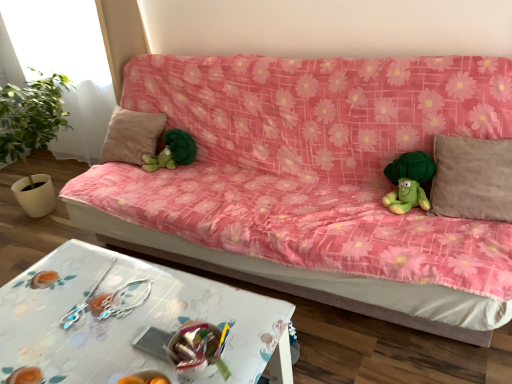
What do you see at coordinates (83, 304) in the screenshot? I see `silver metallic earrings at lower center` at bounding box center [83, 304].

Where is `beige fabric pillow at center, acting as the 2th pillow starting from the right`? beige fabric pillow at center, acting as the 2th pillow starting from the right is located at coordinates (132, 136).

The height and width of the screenshot is (384, 512). What do you see at coordinates (132, 320) in the screenshot?
I see `white glossy table at lower center` at bounding box center [132, 320].

What do you see at coordinates (409, 182) in the screenshot? This screenshot has height=384, width=512. I see `green plush toy at right, the second toy from the left` at bounding box center [409, 182].

You are a GUI agent. You are given a task and a screenshot of the screen. Output one action in this format:
    pyautogui.click(x=<x>, y=<y>)
    Task: Click on the green plush toy at center, which is counted as the second toy, starting from the front
    
    Given the screenshot: What is the action you would take?
    pyautogui.click(x=172, y=152)

The image size is (512, 384). What do you see at coordinates (172, 152) in the screenshot? I see `green plush toy at center, acting as the 1th toy starting from the left` at bounding box center [172, 152].

What do you see at coordinates (472, 178) in the screenshot? I see `beige fabric pillow at right, which is counted as the 2th pillow, starting from the left` at bounding box center [472, 178].

Identify the location of transparent glass window at upper left. (63, 65).

What is the approximate height of transparent glass window at upper left?

1.15 meters.

I want to click on silver metallic earrings at lower center, so (x=83, y=304).

Between white glossy table at lower center and silver metallic earrings at lower center, which one is positioned behind?

silver metallic earrings at lower center is further from the camera.

Between white glossy table at lower center and silver metallic earrings at lower center, which one has more height?

white glossy table at lower center.

Is white glossy table at lower center not close to silver metallic earrings at lower center?

Actually, white glossy table at lower center and silver metallic earrings at lower center are a little close together.

Considering the sizes of objects white glossy table at lower center and silver metallic earrings at lower center in the image provided, who is wider, white glossy table at lower center or silver metallic earrings at lower center?

white glossy table at lower center.

Which is correct: beige fabric pillow at right, which is counted as the 2th pillow, starting from the left, is inside transparent glass window at upper left, or outside of it?

beige fabric pillow at right, which is counted as the 2th pillow, starting from the left, is located beyond the bounds of transparent glass window at upper left.

Which object is thinner, beige fabric pillow at right, which appears as the first pillow when viewed from the right, or transparent glass window at upper left?

With smaller width is transparent glass window at upper left.

Which object is closer to the camera, beige fabric pillow at right, the 2th pillow in the back-to-front sequence, or transparent glass window at upper left?

beige fabric pillow at right, the 2th pillow in the back-to-front sequence, is more forward.

Are beige fabric pillow at right, which ranks as the first pillow in front-to-back order, and transparent glass window at upper left making contact?

No, beige fabric pillow at right, which ranks as the first pillow in front-to-back order, is not in contact with transparent glass window at upper left.

Does white glossy table at lower center have a smaller size compared to green plush toy at right, positioned as the 1th toy in right-to-left order?

No.

From a real-world perspective, is white glossy table at lower center on green plush toy at right, the second toy from the left?

Incorrect, from a real-world perspective, white glossy table at lower center is lower than green plush toy at right, the second toy from the left.

Who is taller, white glossy table at lower center or green plush toy at right, the second toy from the left?

white glossy table at lower center is taller.

Consider the image. Measure the distance between white glossy table at lower center and green plush toy at right, positioned as the 1th toy in right-to-left order.

37.05 inches.

Considering the points (409, 205) and (313, 78), which point is behind, point (409, 205) or point (313, 78)?

The point (313, 78) is more distant.

From their relative heights in the image, would you say green plush toy at right, the second toy from the left, is taller or shorter than pink floral fabric couch at center?

green plush toy at right, the second toy from the left, is shorter than pink floral fabric couch at center.

Consider the image. From a real-world perspective, between green plush toy at right, positioned as the 1th toy in right-to-left order, and pink floral fabric couch at center, who is vertically higher?

green plush toy at right, positioned as the 1th toy in right-to-left order, is physically above.

Considering the positions of objects green plush toy at right, the second toy when ordered from back to front, and pink floral fabric couch at center in the image provided, who is more to the right, green plush toy at right, the second toy when ordered from back to front, or pink floral fabric couch at center?

green plush toy at right, the second toy when ordered from back to front, is more to the right.

Is beige fabric pillow at center, placed as the first pillow when sorted from left to right, far away from green plush toy at right, the second toy from the left?

Yes, beige fabric pillow at center, placed as the first pillow when sorted from left to right, and green plush toy at right, the second toy from the left, are quite far apart.

Considering the points (132, 133) and (399, 168), which point is behind, point (132, 133) or point (399, 168)?

The point (132, 133) is more distant.

Is beige fabric pillow at center, placed as the first pillow when sorted from left to right, to the left or to the right of green plush toy at right, the second toy when ordered from back to front, in the image?

beige fabric pillow at center, placed as the first pillow when sorted from left to right, is positioned on green plush toy at right, the second toy when ordered from back to front,'s left side.

Based on the photo, could you tell me if silver metallic earrings at lower center is facing transparent glass window at upper left?

No, silver metallic earrings at lower center is not turned towards transparent glass window at upper left.

Who is taller, silver metallic earrings at lower center or transparent glass window at upper left?

Standing taller between the two is transparent glass window at upper left.

Is point (113, 264) farther from camera compared to point (84, 53)?

No, (113, 264) is closer to viewer.

Which of these two, silver metallic earrings at lower center or transparent glass window at upper left, is bigger?

Bigger between the two is transparent glass window at upper left.

Does beige fabric pillow at center, placed as the first pillow when sorted from left to right, contain transparent glass window at upper left?

That's incorrect, transparent glass window at upper left is not inside beige fabric pillow at center, placed as the first pillow when sorted from left to right.

Is beige fabric pillow at center, acting as the 2th pillow starting from the right, oriented towards transparent glass window at upper left?

No, beige fabric pillow at center, acting as the 2th pillow starting from the right, does not turn towards transparent glass window at upper left.

From a real-world perspective, is beige fabric pillow at center, the 2th pillow when ordered from front to back, above or below transparent glass window at upper left?

beige fabric pillow at center, the 2th pillow when ordered from front to back, is below transparent glass window at upper left.

Between beige fabric pillow at center, arranged as the first pillow when viewed from the back, and transparent glass window at upper left, which one has more height?

transparent glass window at upper left is taller.

What are the coordinates of `twin behind the white glossy table at lower center` in the screenshot? It's located at (83, 304).

From the image's perspective, which pillow is the 2nd one below the transparent glass window at upper left? Please provide its 2D coordinates.

[(472, 178)]

Which object lies further to the anchor point transparent glass window at upper left, green plush toy at center, marked as the 2th toy in a right-to-left arrangement, or beige fabric pillow at right, the 2th pillow in the back-to-front sequence?

Based on the image, beige fabric pillow at right, the 2th pillow in the back-to-front sequence, appears to be further to transparent glass window at upper left.

Consider the image. Considering their positions, is beige fabric pillow at center, the 2th pillow when ordered from front to back, positioned further to pink floral fabric couch at center than beige fabric pillow at right, the 2th pillow in the back-to-front sequence?

Based on the image, beige fabric pillow at center, the 2th pillow when ordered from front to back, appears to be further to pink floral fabric couch at center.

Estimate the real-world distances between objects in this image. Which object is further from transparent glass window at upper left, white glossy table at lower center or green plush toy at center, acting as the 1th toy starting from the left?

white glossy table at lower center lies further to transparent glass window at upper left than the other object.

Based on the photo, estimate the real-world distances between objects in this image. Which object is further from beige fabric pillow at center, acting as the 2th pillow starting from the right, green plush toy at right, the second toy from the left, or green plush toy at center, which is counted as the second toy, starting from the front?

The object further to beige fabric pillow at center, acting as the 2th pillow starting from the right, is green plush toy at right, the second toy from the left.

Which object lies nearer to the anchor point white glossy table at lower center, beige fabric pillow at center, the 2th pillow when ordered from front to back, or beige fabric pillow at right, the 2th pillow in the back-to-front sequence?

Among the two, beige fabric pillow at right, the 2th pillow in the back-to-front sequence, is located nearer to white glossy table at lower center.

Looking at the image, which one is located closer to white glossy table at lower center, green plush toy at right, which is the first toy in front-to-back order, or beige fabric pillow at right, which is counted as the 2th pillow, starting from the left?

Among the two, green plush toy at right, which is the first toy in front-to-back order, is located nearer to white glossy table at lower center.

Which object lies nearer to the anchor point beige fabric pillow at center, arranged as the first pillow when viewed from the back, white glossy table at lower center or green plush toy at center, which is counted as the second toy, starting from the front?

The object closer to beige fabric pillow at center, arranged as the first pillow when viewed from the back, is green plush toy at center, which is counted as the second toy, starting from the front.

Which object lies nearer to the anchor point transparent glass window at upper left, green plush toy at right, the second toy from the left, or pink floral fabric couch at center?

The object closer to transparent glass window at upper left is pink floral fabric couch at center.

This screenshot has width=512, height=384. What are the coordinates of `toy located between beige fabric pillow at center, arranged as the first pillow when viewed from the back, and green plush toy at right, which is the first toy in front-to-back order, in the left-right direction` in the screenshot? It's located at (172, 152).

This screenshot has height=384, width=512. In order to click on toy located between pink floral fabric couch at center and green plush toy at center, which is counted as the second toy, starting from the front, in the depth direction in this screenshot , I will do `click(409, 182)`.

At what (x,y) coordinates should I click in order to perform the action: click on twin between white glossy table at lower center and green plush toy at center, marked as the 2th toy in a right-to-left arrangement, in the front-back direction. Please return your answer as a coordinate pair (x, y). The width and height of the screenshot is (512, 384). Looking at the image, I should click on (83, 304).

I want to click on toy positioned between white glossy table at lower center and green plush toy at center, marked as the 2th toy in a right-to-left arrangement, from near to far, so click(x=409, y=182).